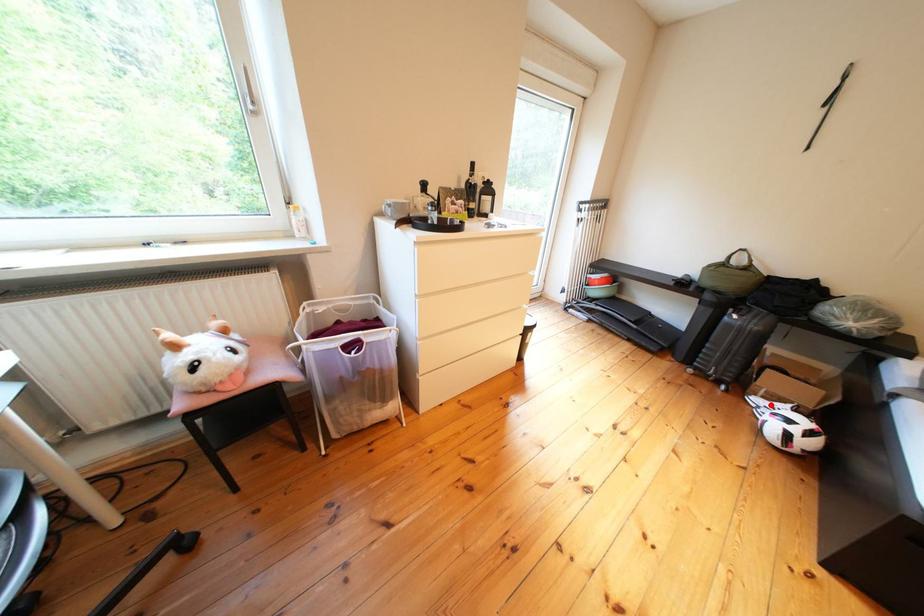
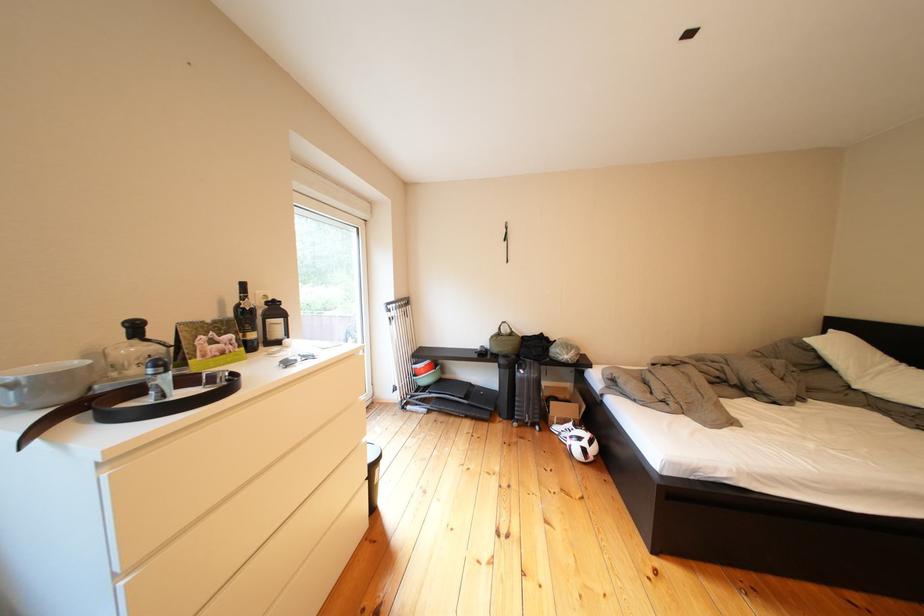
The point at the highlighted location is marked in the first image. Where is the corresponding point in the second image?

(570, 432)